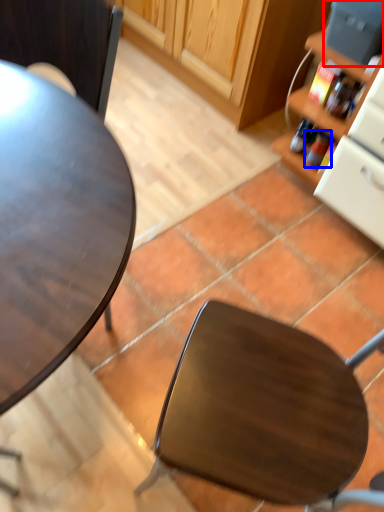
Question: Among these objects, which one is nearest to the camera, appliance (highlighted by a red box) or bottle (highlighted by a blue box)?

Choices:
 (A) appliance
 (B) bottle

Answer: (A)